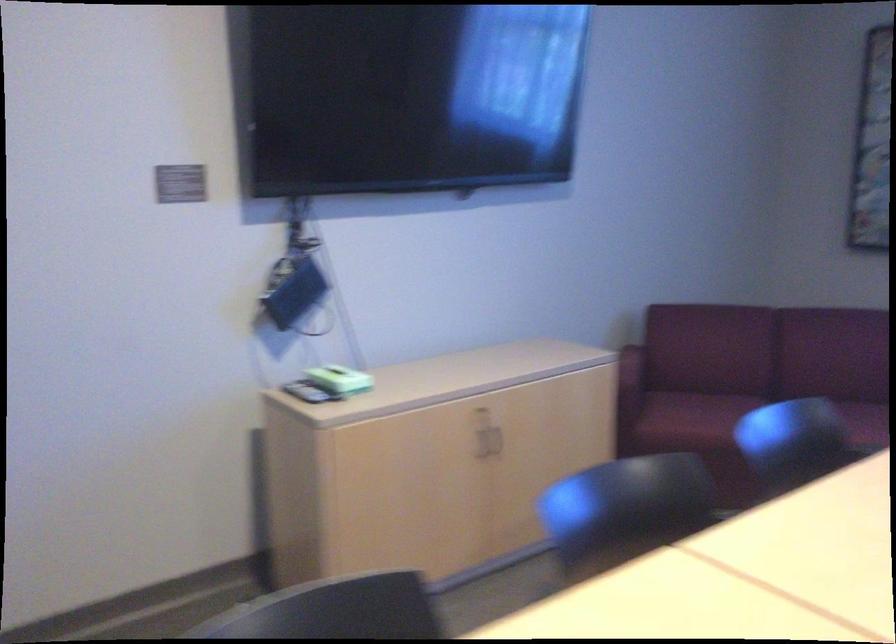
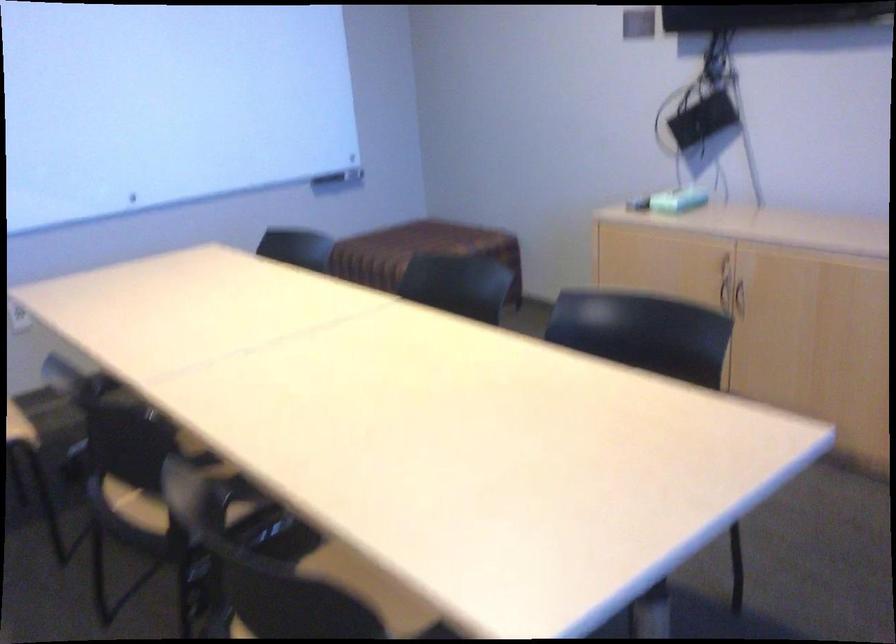
In the second image, find the point that corresponds to pixel 464 453 in the first image.

(725, 295)